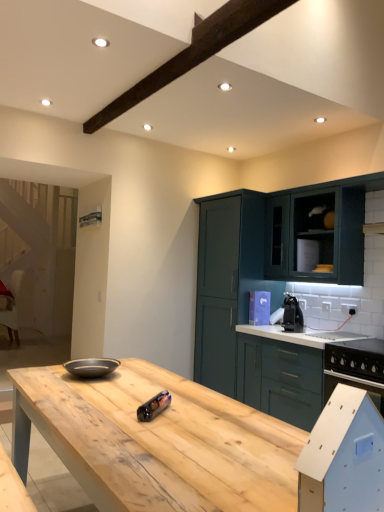
Image resolution: width=384 pixels, height=512 pixels. In order to click on vacant space positioned to the left of metallic cylindrical can at center, the second appliance when ordered from top to bottom in this screenshot , I will do `click(116, 411)`.